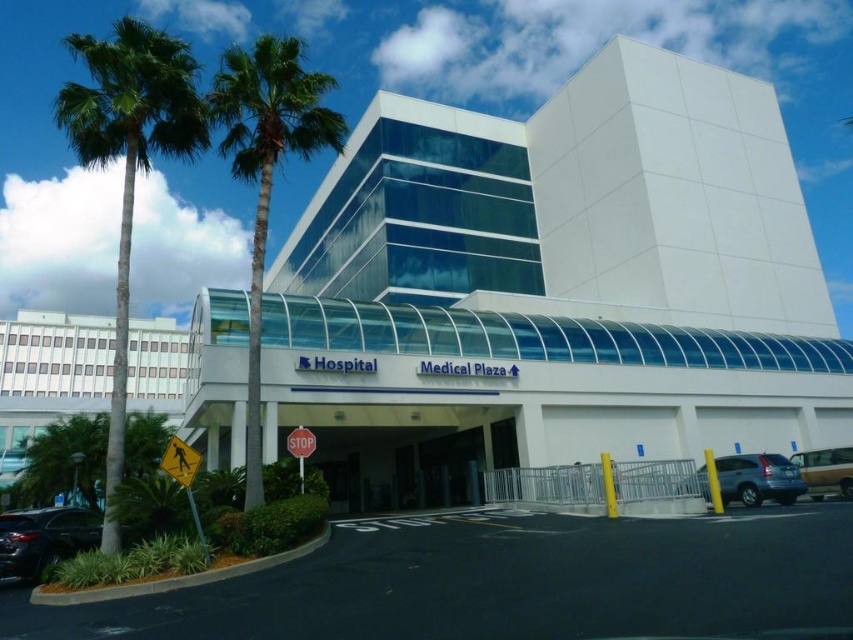
Question: Does white matte building at left have a lesser width compared to metallic silver van at lower right?

Choices:
 (A) yes
 (B) no

Answer: (B)

Question: Among these objects, which one is farthest from the camera?

Choices:
 (A) white glass building at center
 (B) matte gray suv at lower right
 (C) green leafy palm tree at left

Answer: (B)

Question: Does green leafy palm tree at left appear under matte gray suv at lower right?

Choices:
 (A) no
 (B) yes

Answer: (A)

Question: Which of the following is the farthest from the observer?

Choices:
 (A) (30, 547)
 (B) (465, 484)
 (C) (842, 458)

Answer: (B)

Question: Which point is closer to the camera?

Choices:
 (A) white matte building at left
 (B) transparent glass door at center

Answer: (A)

Question: Considering the relative positions of green leafy palm tree at left and green leafy palm tree at center in the image provided, where is green leafy palm tree at left located with respect to green leafy palm tree at center?

Choices:
 (A) below
 (B) above

Answer: (A)